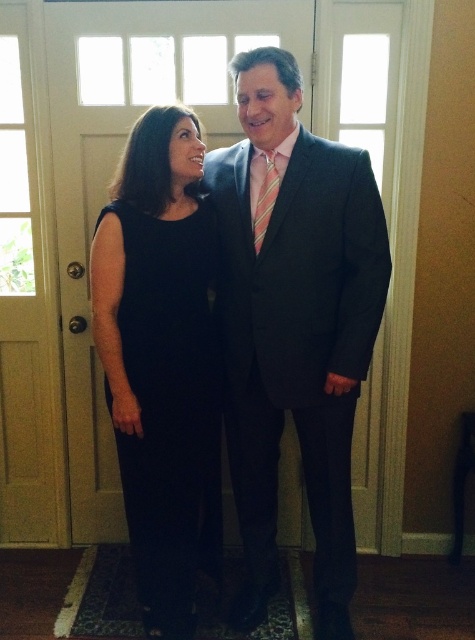
Question: Which point is farther to the camera?

Choices:
 (A) click(x=154, y=474)
 (B) click(x=269, y=163)
 (C) click(x=350, y=550)

Answer: (C)

Question: Is black satin dress at center below black satin dress at left?

Choices:
 (A) no
 (B) yes

Answer: (A)

Question: Is black satin dress at left to the right of striped silk tie at center from the viewer's perspective?

Choices:
 (A) yes
 (B) no

Answer: (B)

Question: Which object is positioned closest to the striped silk tie at center?

Choices:
 (A) black satin dress at left
 (B) black satin dress at center

Answer: (B)

Question: Which object appears farthest from the camera in this image?

Choices:
 (A) striped silk tie at center
 (B) black satin dress at center

Answer: (A)

Question: Observing the image, what is the correct spatial positioning of black satin dress at center in reference to black satin dress at left?

Choices:
 (A) left
 (B) right

Answer: (B)